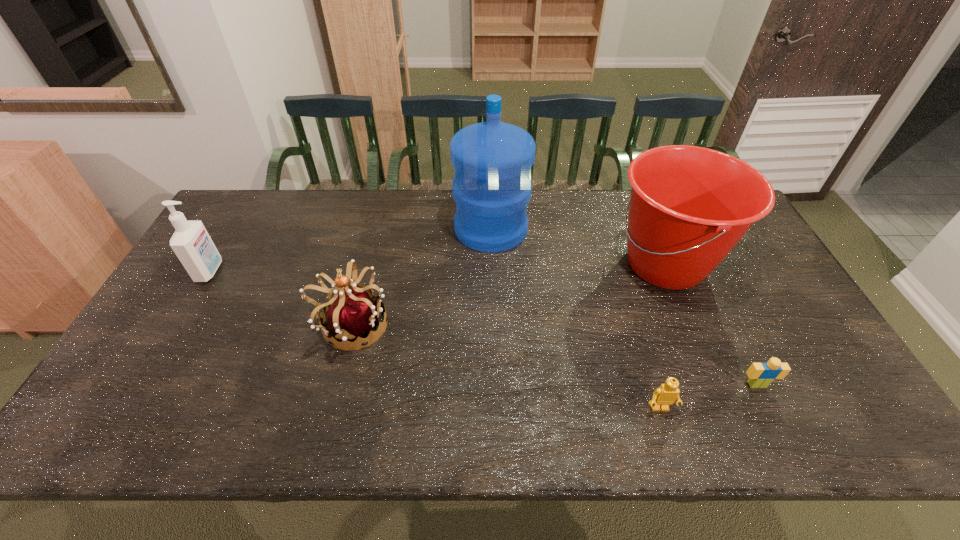
Identify the location of object that ranks as the fifth closest to the second nearest object. The image size is (960, 540). (191, 242).

What are the coordinates of `free space that satisfies the following two spatial constraints: 1. on the front side of the fourth object from right to left; 2. on the front-facing side of the tiara` in the screenshot? It's located at (493, 325).